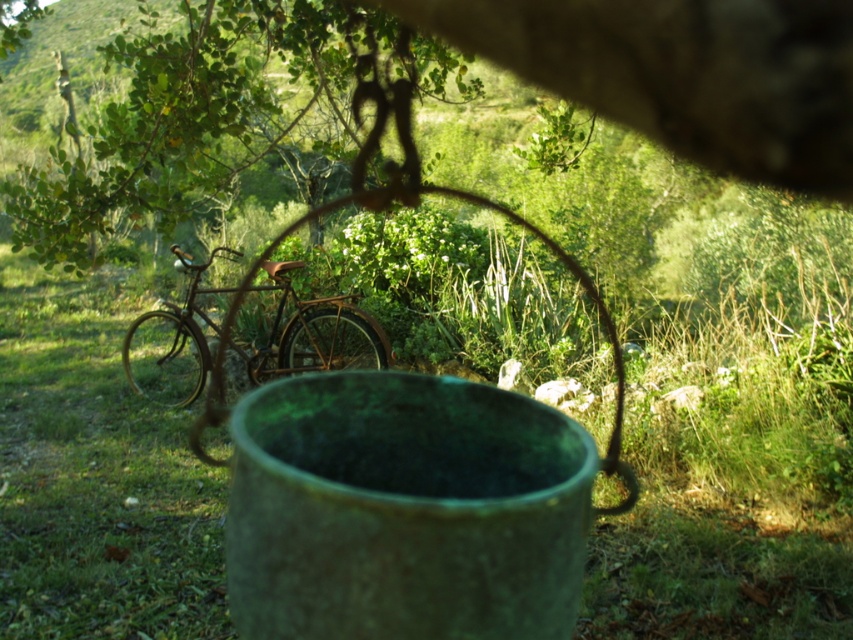
Find the location of a particular element. green leafy tree at upper center is located at coordinates (686, 74).

Which is above, green leafy tree at upper center or rusty metal bicycle at center?

green leafy tree at upper center is above.

This screenshot has height=640, width=853. Find the location of `green leafy tree at upper center`. green leafy tree at upper center is located at coordinates (686, 74).

The width and height of the screenshot is (853, 640). What are the coordinates of `green leafy tree at upper center` in the screenshot? It's located at tap(686, 74).